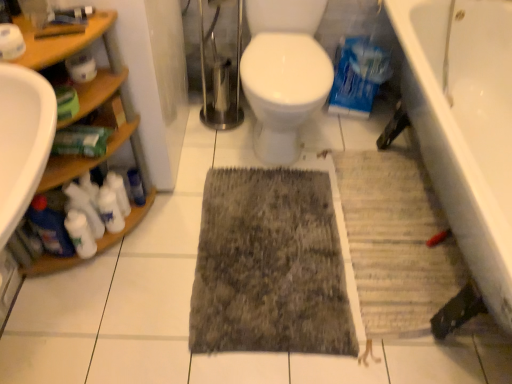
At what (x,y) coordinates should I click in order to perform the action: click on vacant space in front of woodenshelves at left. Please return your answer as a coordinate pair (x, y). The height and width of the screenshot is (384, 512). Looking at the image, I should click on (83, 322).